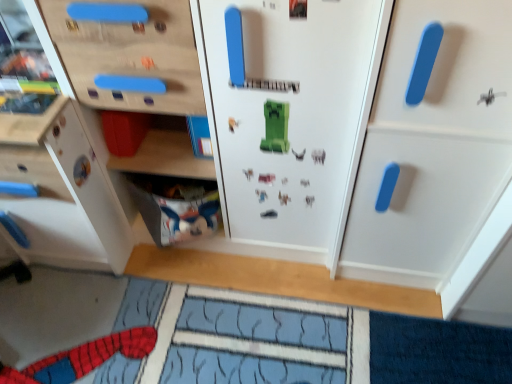
Question: Does white matte cabinet at left, the second cabinetry viewed from the right, come behind white matte cabinet at right, arranged as the second cabinetry when viewed from the left?

Choices:
 (A) no
 (B) yes

Answer: (B)

Question: Can you confirm if white matte cabinet at left, the second cabinetry viewed from the right, is taller than white matte cabinet at right, arranged as the second cabinetry when viewed from the left?

Choices:
 (A) yes
 (B) no

Answer: (B)

Question: Is white matte cabinet at left, positioned as the first cabinetry in left-to-right order, completely or partially outside of white matte cabinet at right, arranged as the second cabinetry when viewed from the left?

Choices:
 (A) no
 (B) yes

Answer: (B)

Question: Is white matte cabinet at left, positioned as the first cabinetry in left-to-right order, touching white matte cabinet at right, arranged as the second cabinetry when viewed from the left?

Choices:
 (A) no
 (B) yes

Answer: (A)

Question: From a real-world perspective, is white matte cabinet at left, positioned as the first cabinetry in left-to-right order, on white matte cabinet at right, which is the first cabinetry from right to left?

Choices:
 (A) yes
 (B) no

Answer: (B)

Question: From a real-world perspective, is white matte cabinet at left, the second cabinetry viewed from the right, above or below white fabric at lower left?

Choices:
 (A) above
 (B) below

Answer: (A)

Question: From the image's perspective, is white matte cabinet at left, the second cabinetry viewed from the right, located above or below white fabric at lower left?

Choices:
 (A) above
 (B) below

Answer: (A)

Question: Considering the positions of point (33, 244) and point (168, 225), is point (33, 244) closer or farther from the camera than point (168, 225)?

Choices:
 (A) closer
 (B) farther

Answer: (B)

Question: Based on their sizes in the image, would you say white matte cabinet at left, the second cabinetry viewed from the right, is bigger or smaller than white fabric at lower left?

Choices:
 (A) small
 (B) big

Answer: (B)

Question: Considering the positions of white matte cabinet at left, the second cabinetry viewed from the right, and white matte cabinet at right, arranged as the second cabinetry when viewed from the left, in the image, is white matte cabinet at left, the second cabinetry viewed from the right, taller or shorter than white matte cabinet at right, arranged as the second cabinetry when viewed from the left,?

Choices:
 (A) short
 (B) tall

Answer: (A)

Question: Visually, is white matte cabinet at left, the second cabinetry viewed from the right, positioned to the left or to the right of white matte cabinet at right, arranged as the second cabinetry when viewed from the left?

Choices:
 (A) left
 (B) right

Answer: (A)

Question: From a real-world perspective, is white matte cabinet at left, the second cabinetry viewed from the right, physically located above or below white matte cabinet at right, arranged as the second cabinetry when viewed from the left?

Choices:
 (A) above
 (B) below

Answer: (B)

Question: From the image's perspective, is white matte cabinet at left, the second cabinetry viewed from the right, positioned above or below white matte cabinet at right, which is the first cabinetry from right to left?

Choices:
 (A) above
 (B) below

Answer: (A)

Question: Do you think white matte cabinet at right, which is the first cabinetry from right to left, is within white matte cabinet at left, the second cabinetry viewed from the right, or outside of it?

Choices:
 (A) outside
 (B) inside

Answer: (A)

Question: From a real-world perspective, is white matte cabinet at right, which is the first cabinetry from right to left, physically located above or below white matte cabinet at left, positioned as the first cabinetry in left-to-right order?

Choices:
 (A) below
 (B) above

Answer: (B)